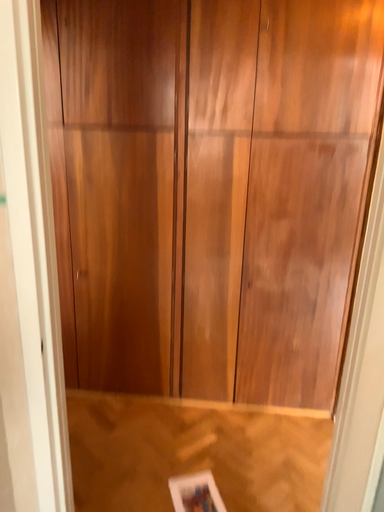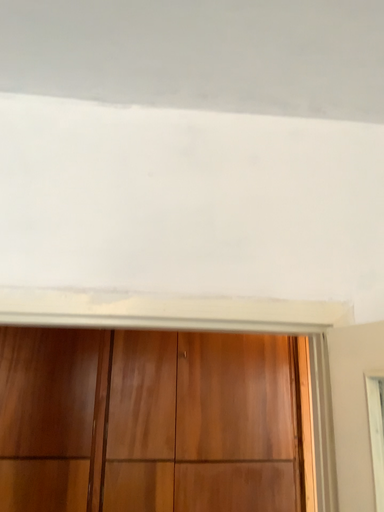
Question: How did the camera likely rotate when shooting the video?

Choices:
 (A) rotated upward
 (B) rotated downward

Answer: (A)